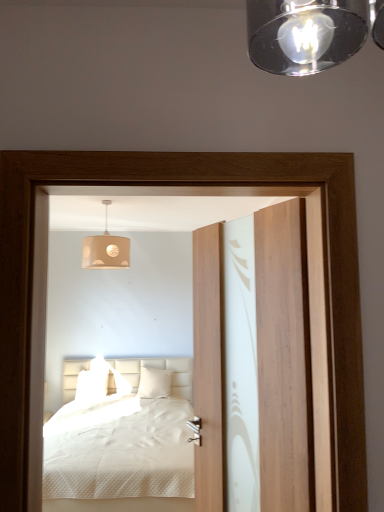
Question: Does beige fabric lampshade at upper center have a smaller size compared to transparent wood screen door at center?

Choices:
 (A) yes
 (B) no

Answer: (A)

Question: Can you confirm if beige fabric lampshade at upper center is thinner than transparent wood screen door at center?

Choices:
 (A) yes
 (B) no

Answer: (B)

Question: Is beige fabric lampshade at upper center at the left side of transparent wood screen door at center?

Choices:
 (A) yes
 (B) no

Answer: (A)

Question: Could transparent wood screen door at center be considered to be inside beige fabric lampshade at upper center?

Choices:
 (A) yes
 (B) no

Answer: (B)

Question: Can you confirm if beige fabric lampshade at upper center is shorter than transparent wood screen door at center?

Choices:
 (A) no
 (B) yes

Answer: (B)

Question: Is beige fabric lampshade at upper center positioned behind transparent wood screen door at center?

Choices:
 (A) yes
 (B) no

Answer: (A)

Question: Is white soft pillow at center surrounded by white textured bed at center?

Choices:
 (A) yes
 (B) no

Answer: (A)

Question: Is white textured bed at center thinner than white soft pillow at center?

Choices:
 (A) yes
 (B) no

Answer: (B)

Question: From a real-world perspective, does white textured bed at center stand above white soft pillow at center?

Choices:
 (A) yes
 (B) no

Answer: (B)

Question: From the image's perspective, is white textured bed at center below white soft pillow at center?

Choices:
 (A) yes
 (B) no

Answer: (A)

Question: Considering the relative sizes of white textured bed at center and white soft pillow at center in the image provided, is white textured bed at center taller than white soft pillow at center?

Choices:
 (A) no
 (B) yes

Answer: (B)

Question: Considering the relative positions of white textured bed at center and white soft pillow at center in the image provided, is white textured bed at center in front of white soft pillow at center?

Choices:
 (A) no
 (B) yes

Answer: (B)

Question: Is white textured bed at center placed right next to transparent wood screen door at center?

Choices:
 (A) no
 (B) yes

Answer: (A)